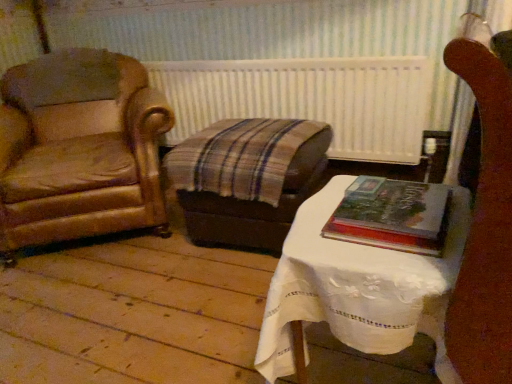
The height and width of the screenshot is (384, 512). What are the coordinates of `vacant space situated on the left part of white lace-covered table at center` in the screenshot? It's located at click(174, 331).